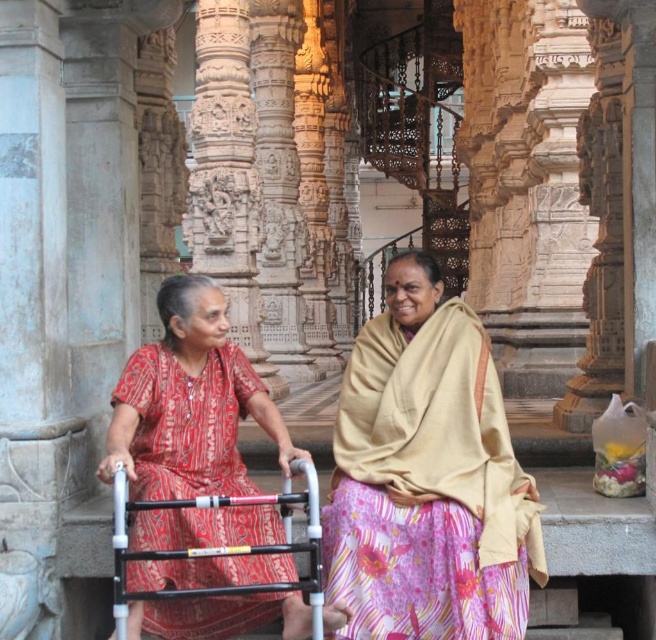
Is beige fabric shawl at center positioned in front of red printed dress at center?

No, it is not.

The width and height of the screenshot is (656, 640). What do you see at coordinates (426, 477) in the screenshot?
I see `beige fabric shawl at center` at bounding box center [426, 477].

I want to click on beige fabric shawl at center, so click(x=426, y=477).